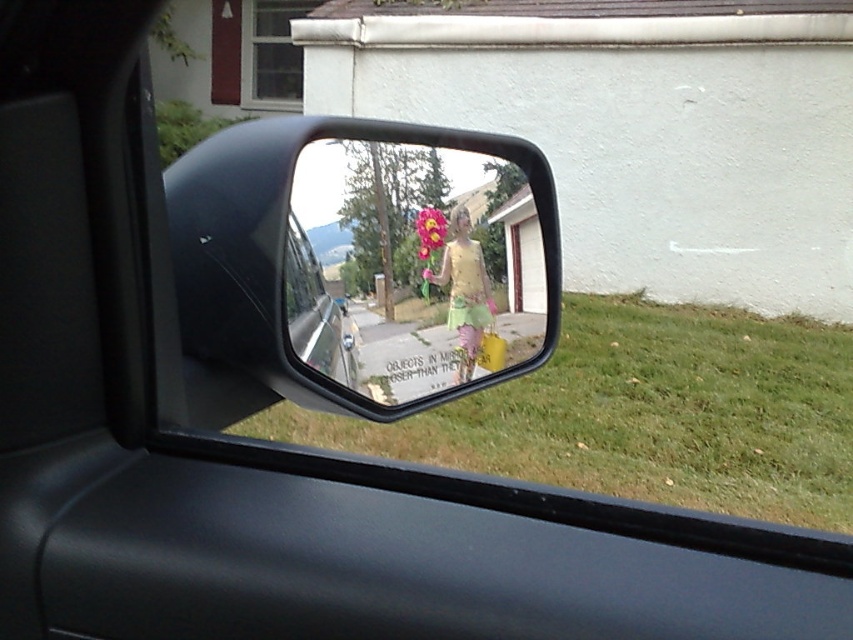
Is the position of matte yellow flower at center less distant than that of fluffy pink flower at center?

Yes, it is in front of fluffy pink flower at center.

Is matte yellow flower at center shorter than fluffy pink flower at center?

Incorrect, matte yellow flower at center's height does not fall short of fluffy pink flower at center's.

Between point (384, 330) and point (421, 244), which one is positioned in front?

Positioned in front is point (384, 330).

The width and height of the screenshot is (853, 640). I want to click on matte yellow flower at center, so click(x=410, y=268).